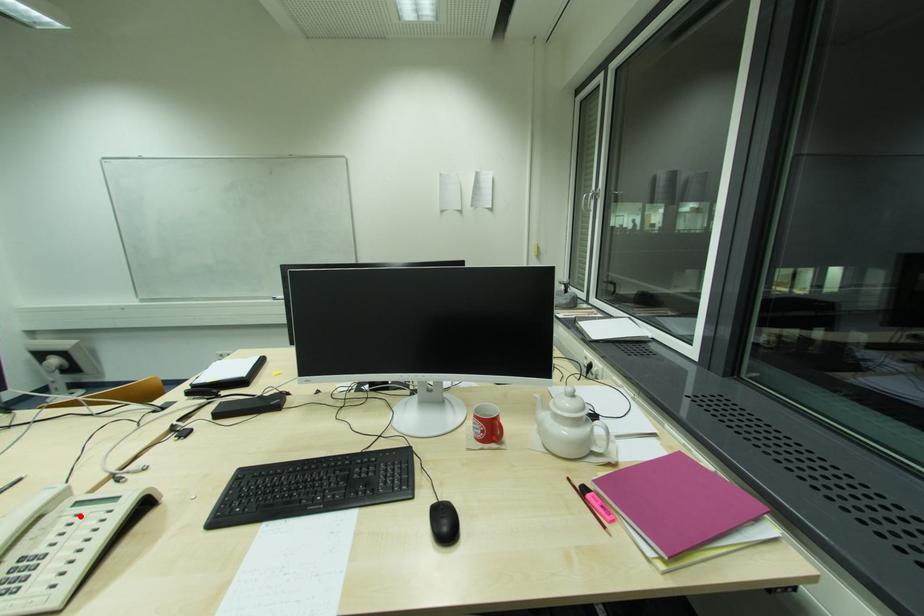
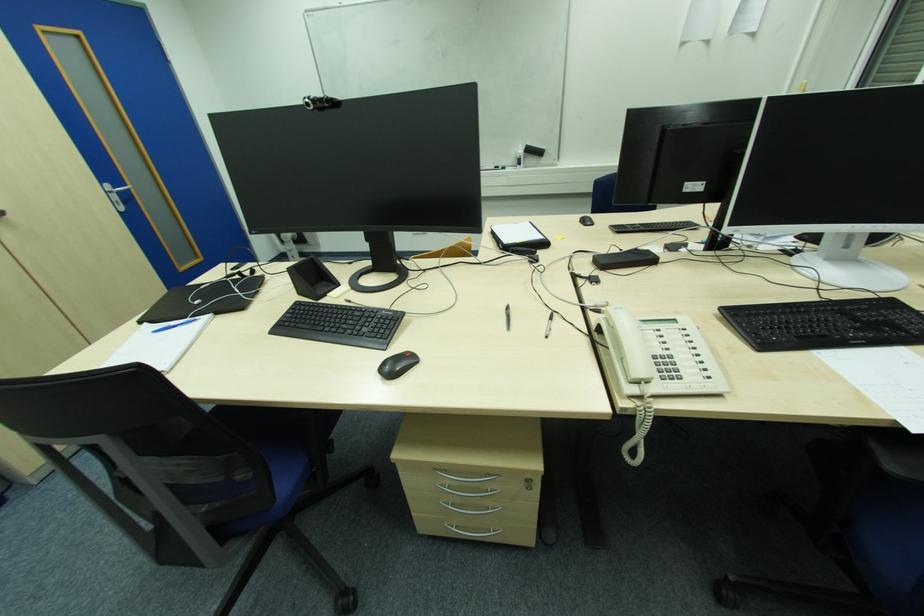
Find the pixel in the second image that matches the highlighted location in the first image.

(661, 331)